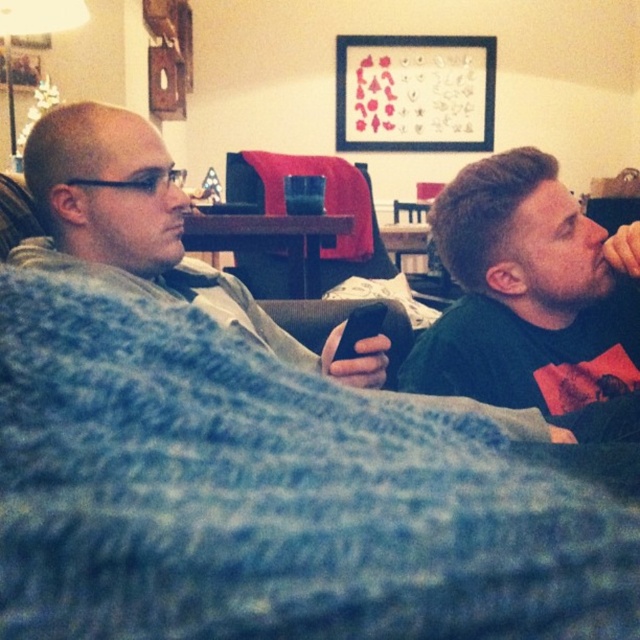
You are a photographer setting up a shot in the living room. You need to ensure that the blue knitted blanket at lower left and the matte gray sweater at left are both visible in the frame. Based on their positions, which object should you prioritize keeping in the lower part of the photo?

The blue knitted blanket at lower left should be prioritized in the lower part of the photo since it is located below the matte gray sweater at left.

You are a photographer trying to capture a closeup of the blue knitted blanket at lower left and the matte gray sweater at left. Which object should you move your camera to the right to focus on?

The blue knitted blanket at lower left is to the right of the matte gray sweater at left, so you should move your camera to the right to focus on the blue knitted blanket at lower left.